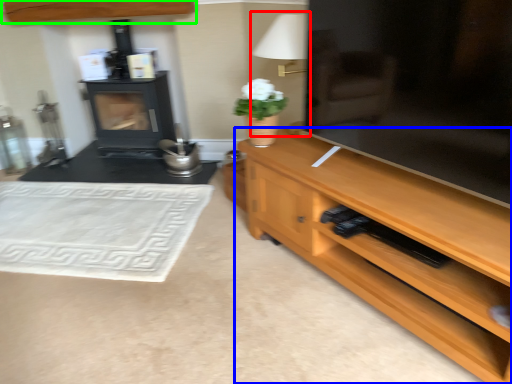
Question: Which object is positioned closest to table lamp (highlighted by a red box)? Select from desk (highlighted by a blue box) and cabinetry (highlighted by a green box).

Choices:
 (A) desk
 (B) cabinetry

Answer: (A)